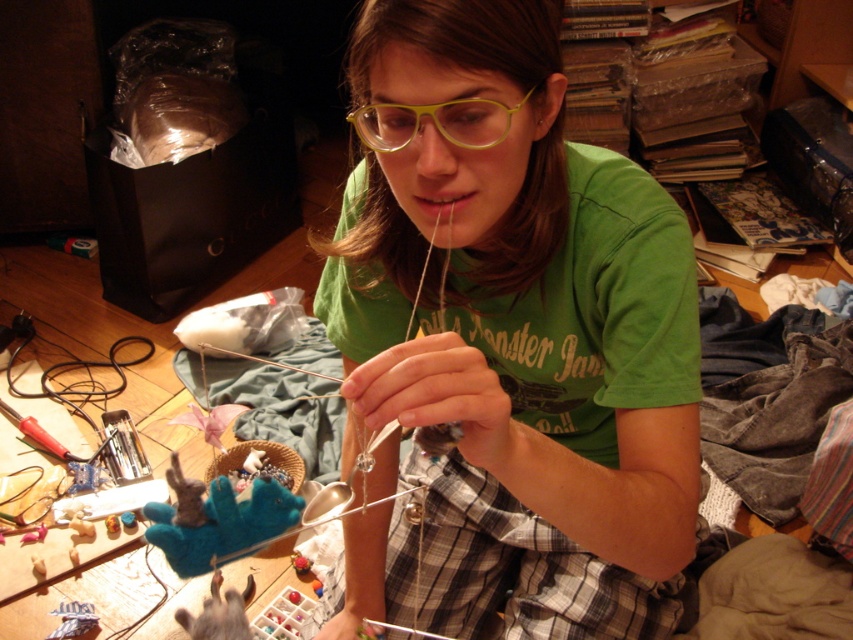
Does green matte shirt at center come behind matte silver necklace at center?

That is True.

Can you confirm if green matte shirt at center is taller than matte silver necklace at center?

Yes, green matte shirt at center is taller than matte silver necklace at center.

Describe the element at coordinates (508, 340) in the screenshot. I see `green matte shirt at center` at that location.

Where is `green matte shirt at center`? green matte shirt at center is located at coordinates (508, 340).

You are a GUI agent. You are given a task and a screenshot of the screen. Output one action in this format:
    pyautogui.click(x=<x>, y=<y>)
    Task: Click on the green matte shirt at center
    The width and height of the screenshot is (853, 640).
    Given the screenshot: What is the action you would take?
    pyautogui.click(x=508, y=340)

Find the location of a particular element. Image resolution: width=853 pixels, height=640 pixels. green matte shirt at center is located at coordinates (508, 340).

Who is more distant from viewer, (433, 352) or (350, 628)?

The point (350, 628) is more distant.

The height and width of the screenshot is (640, 853). Describe the element at coordinates (431, 397) in the screenshot. I see `matte silver necklace at center` at that location.

Where is `matte silver necklace at center`? This screenshot has width=853, height=640. matte silver necklace at center is located at coordinates (431, 397).